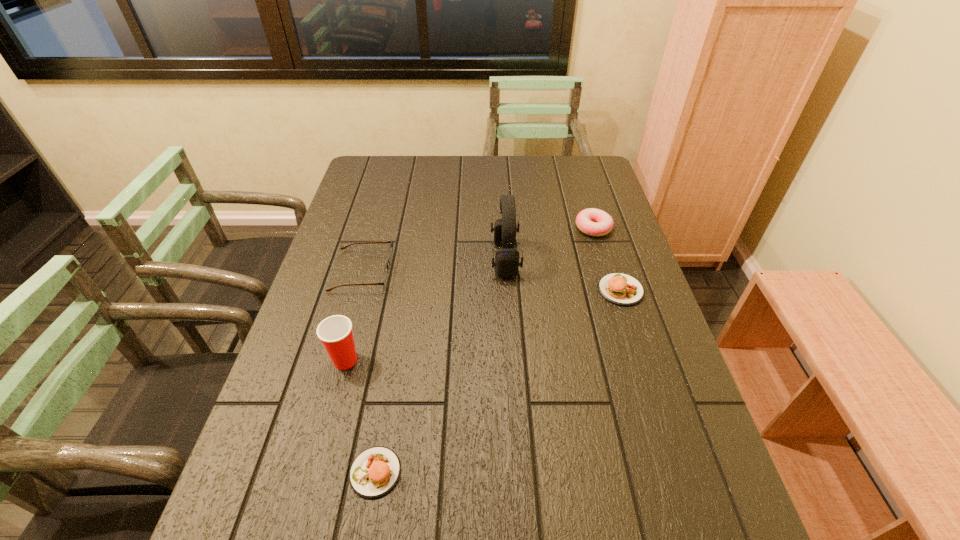
Identify the location of free space at the near right corner. (711, 491).

You are a GUI agent. You are given a task and a screenshot of the screen. Output one action in this format:
    pyautogui.click(x=<x>, y=<y>)
    Task: Click on the vacant area that lies between the spectacles and the doughnut
    The width and height of the screenshot is (960, 540).
    Given the screenshot: What is the action you would take?
    pyautogui.click(x=478, y=249)

At what (x,y) coordinates should I click in order to perform the action: click on free space between the spectacles and the doughnut. Please return your answer as a coordinate pair (x, y). The image size is (960, 540). Looking at the image, I should click on [478, 249].

The height and width of the screenshot is (540, 960). In order to click on vacant space in between the doughnut and the spectacles in this screenshot , I will do `click(478, 249)`.

Identify the location of empty location between the shorter patty and the taller patty. The width and height of the screenshot is (960, 540). (498, 381).

Where is `vacant area that lies between the spectacles and the second nearest object`? The image size is (960, 540). vacant area that lies between the spectacles and the second nearest object is located at coordinates (353, 315).

Where is `vacant space that is in between the shorter patty and the doughnut`? The width and height of the screenshot is (960, 540). vacant space that is in between the shorter patty and the doughnut is located at coordinates (485, 350).

You are a GUI agent. You are given a task and a screenshot of the screen. Output one action in this format:
    pyautogui.click(x=<x>, y=<y>)
    Task: Click on the free spot between the taller patty and the tallest object
    
    Given the screenshot: What is the action you would take?
    pyautogui.click(x=563, y=274)

Locate an element on the screen. This screenshot has height=540, width=960. free spot between the doughnut and the Dixie cup is located at coordinates (469, 294).

In order to click on free space between the fourth object from left to right and the doughnut in this screenshot , I will do `click(549, 243)`.